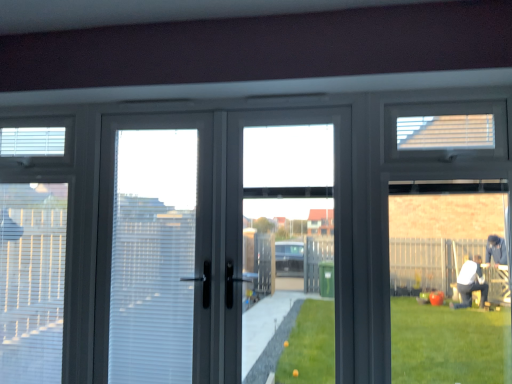
I want to click on transparent glass door at center, so click(334, 195).

What is the approximate height of transparent glass door at center?

transparent glass door at center is 1.41 meters in height.

What is the approximate height of white textured blind at left, which appears as the second blind when viewed from the left?

white textured blind at left, which appears as the second blind when viewed from the left, is 1.09 meters tall.

You are a GUI agent. You are given a task and a screenshot of the screen. Output one action in this format:
    pyautogui.click(x=<x>, y=<y>)
    Task: Click on the white matte blind at upper right, positioned as the 1th blind in front-to-back order
    
    Given the screenshot: What is the action you would take?
    pyautogui.click(x=446, y=132)

You are a GUI agent. You are given a task and a screenshot of the screen. Output one action in this format:
    pyautogui.click(x=<x>, y=<y>)
    Task: Click on the transparent glass door at center
    This screenshot has height=384, width=512.
    Given the screenshot: What is the action you would take?
    click(x=334, y=195)

Based on their positions, is transparent glass door at center located to the left or right of matte gray screen door at center?

transparent glass door at center is positioned on matte gray screen door at center's right side.

From the image's perspective, who appears lower, transparent glass door at center or matte gray screen door at center?

matte gray screen door at center appears lower in the image.

Between transparent glass door at center and matte gray screen door at center, which one has larger width?

matte gray screen door at center is wider.

Based on the photo, is transparent glass door at center looking in the opposite direction of matte gray screen door at center?

transparent glass door at center does not have its back to matte gray screen door at center.

Is transparent glass door at center to the left of white textured blind at left, the third blind when ordered from top to bottom, from the viewer's perspective?

Incorrect, transparent glass door at center is not on the left side of white textured blind at left, the third blind when ordered from top to bottom.

Could you tell me if transparent glass door at center is facing white textured blind at left, which appears as the second blind when viewed from the left?

No, transparent glass door at center is not turned towards white textured blind at left, which appears as the second blind when viewed from the left.

Between point (226, 321) and point (24, 313), which one is positioned in front?

Point (226, 321)

Does transparent glass door at center have a greater width compared to white textured blind at left, the third blind when ordered from top to bottom?

Yes.

Is matte glass window at right inside the boundaries of transparent glass door at center, or outside?

matte glass window at right is not enclosed by transparent glass door at center.

Is matte glass window at right looking in the opposite direction of transparent glass door at center?

matte glass window at right is not turned away from transparent glass door at center.

From the image's perspective, is matte glass window at right above transparent glass door at center?

Indeed, from the image's perspective, matte glass window at right is shown above transparent glass door at center.

In terms of width, does matte glass window at right look wider or thinner when compared to transparent glass door at center?

matte glass window at right is thinner than transparent glass door at center.

Based on the photo, which object is positioned more to the left, matte gray screen door at center or white plastic blind at upper left, placed as the 2th blind when sorted from bottom to top?

From the viewer's perspective, white plastic blind at upper left, placed as the 2th blind when sorted from bottom to top, appears more on the left side.

Is matte gray screen door at center further to camera compared to white plastic blind at upper left, which is counted as the third blind, starting from the right?

No, it is in front of white plastic blind at upper left, which is counted as the third blind, starting from the right.

Is matte gray screen door at center smaller than white plastic blind at upper left, positioned as the 1th blind in back-to-front order?

No.

From the image's perspective, is matte gray screen door at center located above white plastic blind at upper left, acting as the first blind starting from the left?

Incorrect, from the image's perspective, matte gray screen door at center is lower than white plastic blind at upper left, acting as the first blind starting from the left.

Considering the positions of objects white textured blind at left, arranged as the 1th blind when ordered from the bottom, and transparent glass door at center in the image provided, who is more to the right, white textured blind at left, arranged as the 1th blind when ordered from the bottom, or transparent glass door at center?

From the viewer's perspective, transparent glass door at center appears more on the right side.

Is point (35, 371) positioned after point (262, 117)?

Yes, it is.

Which object is more forward, white textured blind at left, the third blind when ordered from top to bottom, or transparent glass door at center?

transparent glass door at center.

From a real-world perspective, which is physically above, matte glass window at right or matte gray screen door at center?

From a 3D spatial view, matte glass window at right is above.

Identify the location of bay window above the matte gray screen door at center (from the image's perspective). This screenshot has width=512, height=384. (448, 240).

Does matte glass window at right turn towards matte gray screen door at center?

No, matte glass window at right is not aimed at matte gray screen door at center.

Is matte glass window at right behind matte gray screen door at center?

That is False.

From the image's perspective, is matte gray screen door at center positioned above or below matte glass window at right?

matte gray screen door at center is below matte glass window at right.

Visually, is matte gray screen door at center positioned to the left or to the right of matte glass window at right?

matte gray screen door at center is positioned on matte glass window at right's left side.

In terms of height, does matte gray screen door at center look taller or shorter compared to matte glass window at right?

Considering their sizes, matte gray screen door at center has more height than matte glass window at right.

Relative to matte glass window at right, is matte gray screen door at center in front or behind?

Visually, matte gray screen door at center is located behind matte glass window at right.

At what (x,y) coordinates should I click in order to perform the action: click on window screen lying on the right of matte gray screen door at center. Please return your answer as a coordinate pair (x, y). The width and height of the screenshot is (512, 384). Looking at the image, I should click on (334, 195).

Identify the location of blind that is the 1st object to the left of the transparent glass door at center, starting at the anchor. click(32, 281).

Based on their spatial positions, is matte gray screen door at center or matte glass window at right further from white textured blind at left, which ranks as the second blind in front-to-back order?

matte glass window at right is positioned further to the anchor white textured blind at left, which ranks as the second blind in front-to-back order.

When comparing their distances from matte glass window at right, does transparent glass door at center or matte gray screen door at center seem closer?

matte gray screen door at center is positioned closer to the anchor matte glass window at right.

From the image, which object appears to be nearer to matte gray screen door at center, white matte blind at upper right, arranged as the third blind when ordered from the bottom, or matte glass window at right?

Based on the image, white matte blind at upper right, arranged as the third blind when ordered from the bottom, appears to be nearer to matte gray screen door at center.

Looking at this image, when comparing their distances from white plastic blind at upper left, placed as the 2th blind when sorted from bottom to top, does white textured blind at left, arranged as the 1th blind when ordered from the bottom, or white matte blind at upper right, the third blind in the back-to-front sequence, seem further?

white matte blind at upper right, the third blind in the back-to-front sequence, is positioned further to the anchor white plastic blind at upper left, placed as the 2th blind when sorted from bottom to top.

Estimate the real-world distances between objects in this image. Which object is further from white matte blind at upper right, the third blind in the back-to-front sequence, matte glass window at right or white textured blind at left, the third blind when ordered from top to bottom?

white textured blind at left, the third blind when ordered from top to bottom, is positioned further to the anchor white matte blind at upper right, the third blind in the back-to-front sequence.

From the image, which object appears to be farther from transparent glass door at center, white textured blind at left, arranged as the 1th blind when ordered from the bottom, or white plastic blind at upper left, positioned as the 1th blind in back-to-front order?

Based on the image, white plastic blind at upper left, positioned as the 1th blind in back-to-front order, appears to be further to transparent glass door at center.

Estimate the real-world distances between objects in this image. Which object is further from white plastic blind at upper left, placed as the 2th blind when sorted from bottom to top, white matte blind at upper right, the third blind in the back-to-front sequence, or transparent glass door at center?

white matte blind at upper right, the third blind in the back-to-front sequence, lies further to white plastic blind at upper left, placed as the 2th blind when sorted from bottom to top, than the other object.

Estimate the real-world distances between objects in this image. Which object is closer to white textured blind at left, acting as the 2th blind starting from the back, transparent glass door at center or white matte blind at upper right, positioned as the 1th blind in front-to-back order?

Among the two, transparent glass door at center is located nearer to white textured blind at left, acting as the 2th blind starting from the back.

What are the coordinates of `screen door between white textured blind at left, which appears as the second blind when viewed from the left, and transparent glass door at center from left to right` in the screenshot? It's located at (158, 245).

At what (x,y) coordinates should I click in order to perform the action: click on blind between white plastic blind at upper left, placed as the second blind when sorted from top to bottom, and transparent glass door at center. Please return your answer as a coordinate pair (x, y). Looking at the image, I should click on (32, 281).

Find the location of a particular element. blind between white plastic blind at upper left, positioned as the 1th blind in back-to-front order, and matte glass window at right, in the horizontal direction is located at coordinates (32, 281).

This screenshot has height=384, width=512. I want to click on bay window between white textured blind at left, the third blind when ordered from top to bottom, and white matte blind at upper right, the 1th blind from the right, from left to right, so click(448, 240).